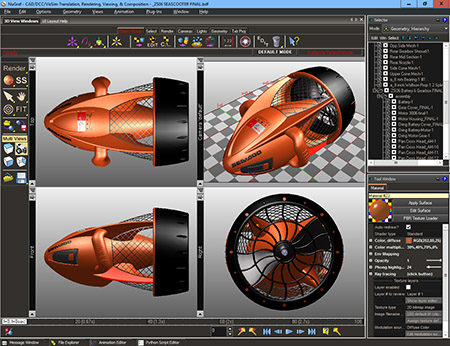
In order to click on window settings in this screenshot , I will do `click(403, 1)`, `click(422, 4)`, `click(444, 5)`.